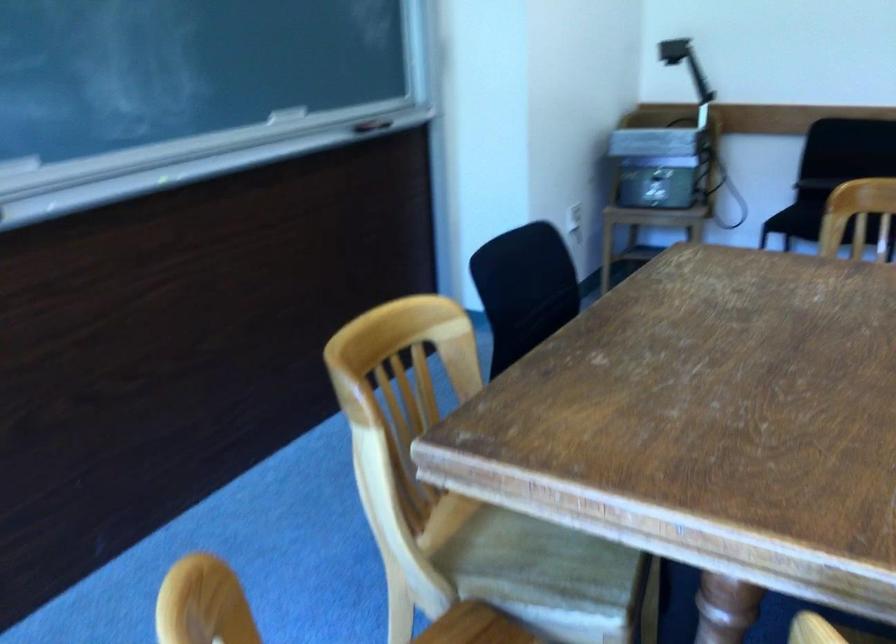
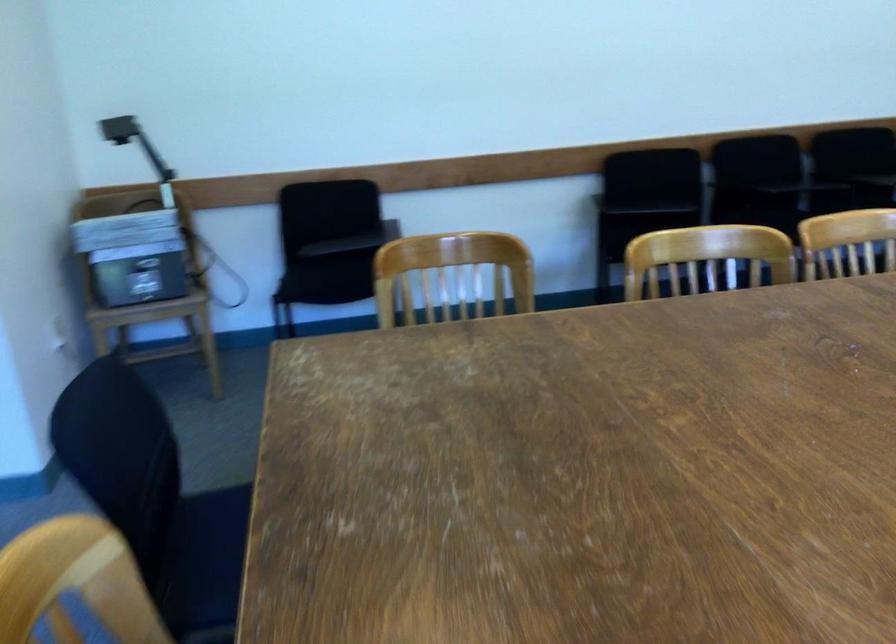
Question: The images are taken continuously from a first-person perspective. In which direction is your viewpoint rotating?

Choices:
 (A) Left
 (B) Right
 (C) Up
 (D) Down

Answer: (B)